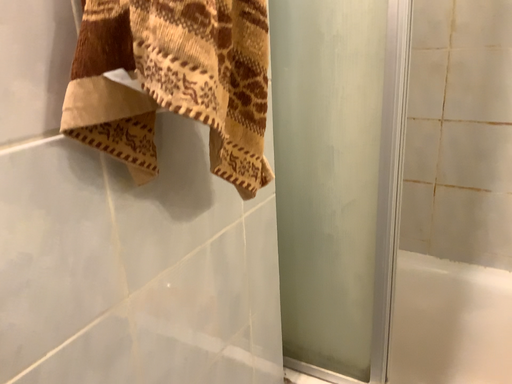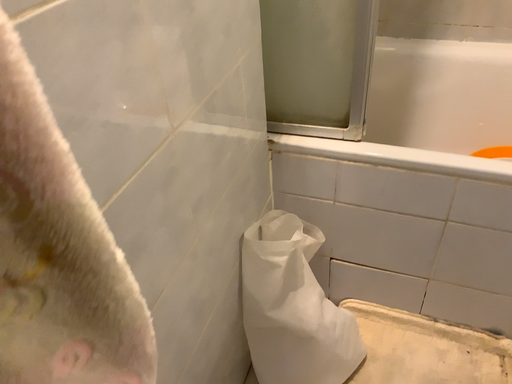
Question: Which way did the camera rotate in the video?

Choices:
 (A) rotated upward
 (B) rotated downward

Answer: (B)